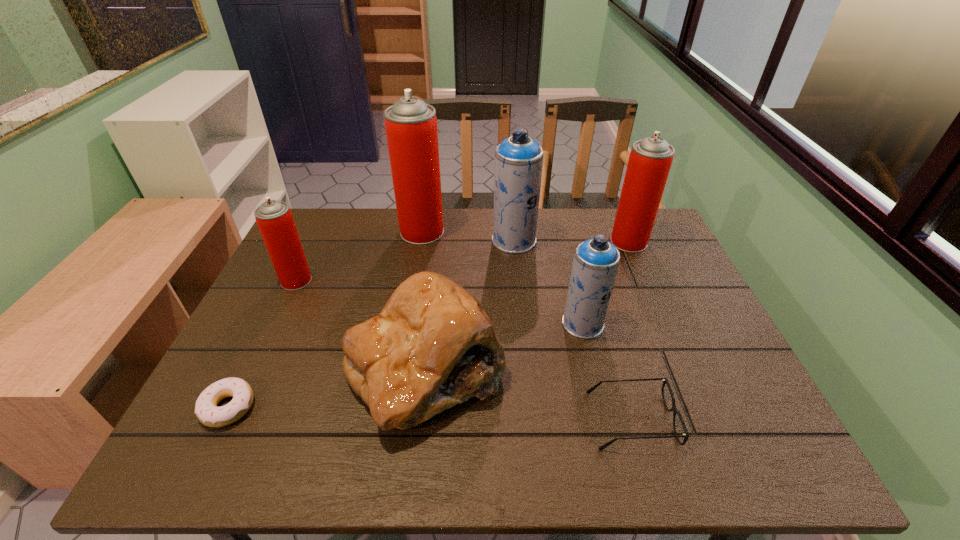
Find the location of a particular element. vacant space located 0.070m with the lenses facing outward on the spectacles is located at coordinates [x=558, y=420].

This screenshot has width=960, height=540. I want to click on free space located 0.090m with the lenses facing outward on the spectacles, so click(x=548, y=420).

I want to click on free region located 0.240m with the lenses facing outward on the spectacles, so click(476, 420).

Locate an element on the screen. The width and height of the screenshot is (960, 540). vacant space positioned 0.160m on the back of the shortest object is located at coordinates (265, 332).

Image resolution: width=960 pixels, height=540 pixels. What are the coordinates of `bread present at the near edge` in the screenshot? It's located at (433, 346).

What are the coordinates of `spectacles that is at the near edge` in the screenshot? It's located at (665, 381).

Where is `doughnut located at the near edge`? doughnut located at the near edge is located at coordinates (206, 410).

Identify the location of aerosol can situated at the left edge. (x=274, y=218).

Image resolution: width=960 pixels, height=540 pixels. I want to click on doughnut at the left edge, so click(x=206, y=410).

I want to click on object present at the right edge, so click(650, 160).